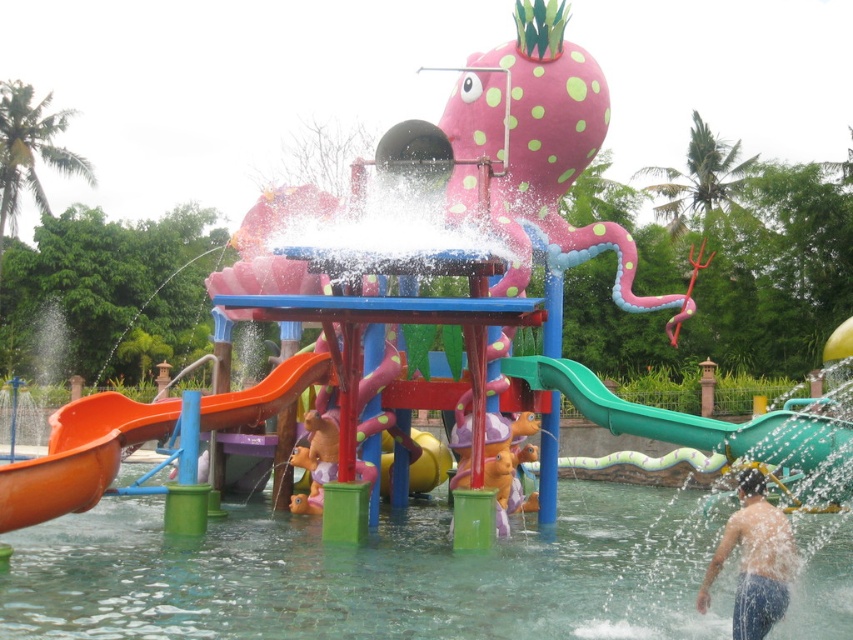
Can you confirm if pink rubber duck at center is positioned to the left of brown plush toy at center?

No, pink rubber duck at center is not to the left of brown plush toy at center.

Between point (512, 490) and point (312, 412), which one is positioned behind?

The point (512, 490) is behind.

Identify the location of pink rubber duck at center. (506, 461).

Which is above, green rubber slide at right or pink rubber duck at center?

green rubber slide at right

This screenshot has height=640, width=853. Describe the element at coordinates (706, 428) in the screenshot. I see `green rubber slide at right` at that location.

I want to click on green rubber slide at right, so click(x=706, y=428).

Who is shorter, clear water at center or green rubber slide at right?

clear water at center

Who is more distant from viewer, (274, 595) or (840, 461)?

Point (840, 461)

Is point (395, 529) farther from viewer compared to point (724, 428)?

Yes, point (395, 529) is farther from viewer.

The image size is (853, 640). I want to click on clear water at center, so click(x=372, y=573).